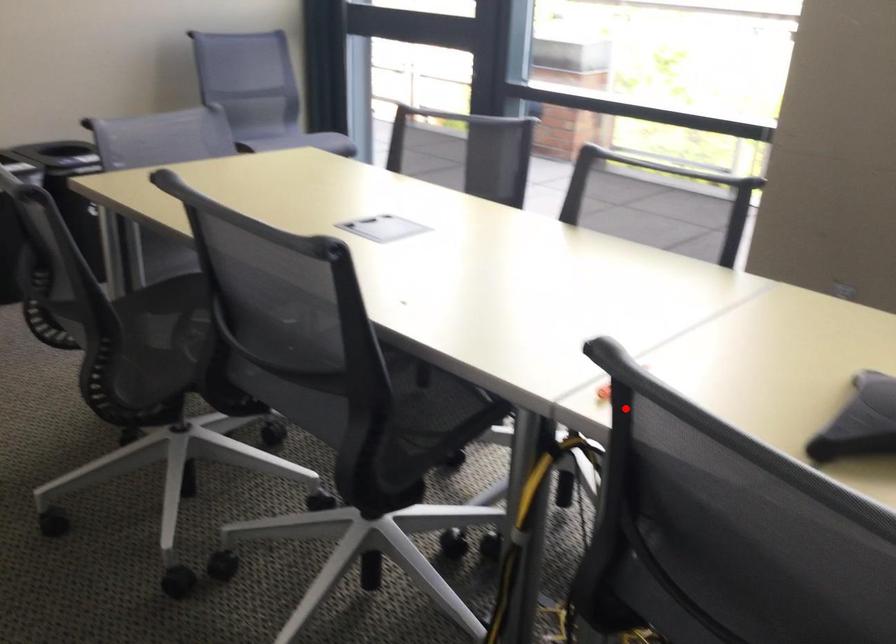
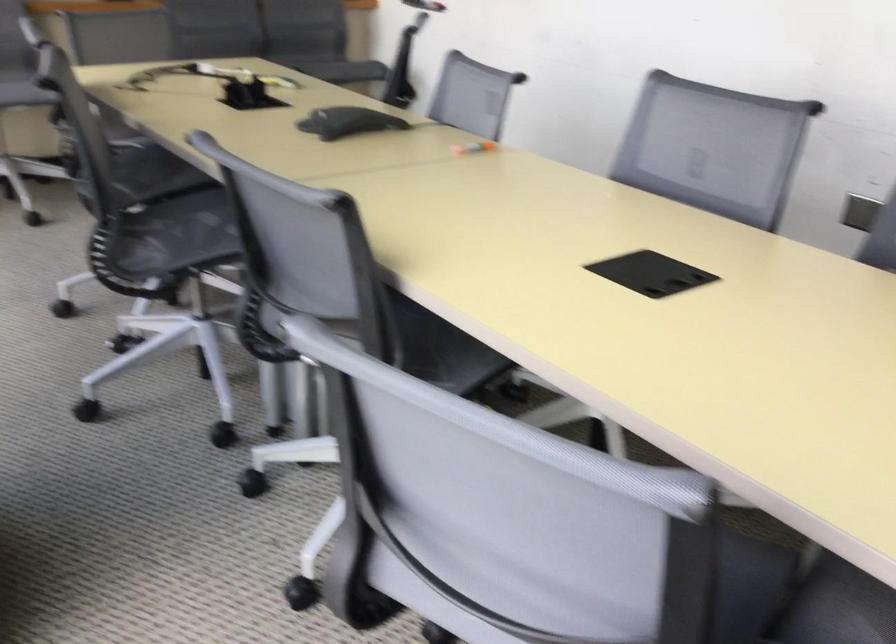
Question: I am providing you with two images of the same scene from different viewpoints. Given a red point in image1, look at the same physical point in image2. Is it:

Choices:
 (A) Closer to the viewpoint
 (B) Farther from the viewpoint

Answer: (B)